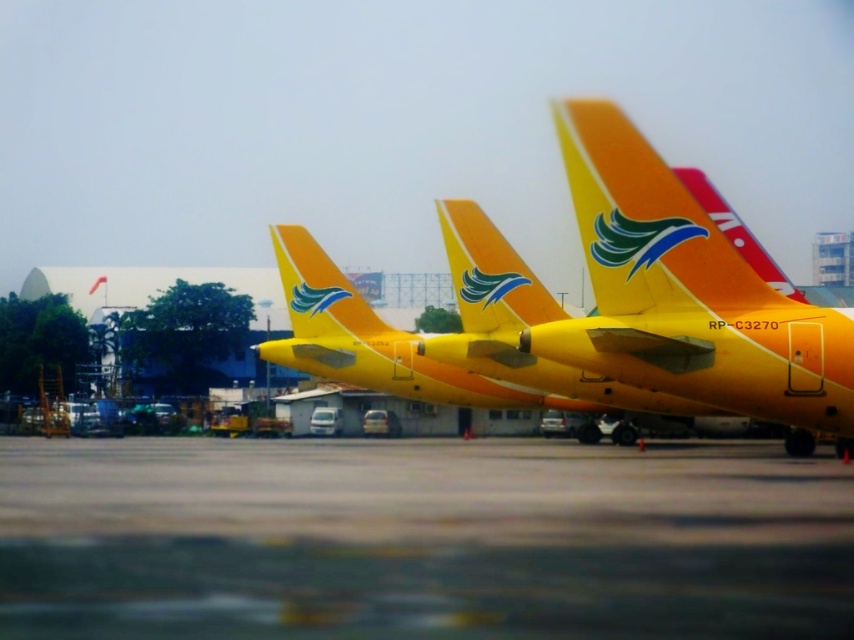
Question: Does gray concrete tarmac at lower center have a smaller size compared to yellow matte airplane at center?

Choices:
 (A) yes
 (B) no

Answer: (A)

Question: Can you confirm if gray concrete tarmac at lower center is positioned to the right of yellow matte airplane at center?

Choices:
 (A) yes
 (B) no

Answer: (B)

Question: Does gray concrete tarmac at lower center appear under yellow matte airplane at center?

Choices:
 (A) yes
 (B) no

Answer: (A)

Question: Which point is farther from the camera taking this photo?

Choices:
 (A) (683, 392)
 (B) (417, 547)

Answer: (A)